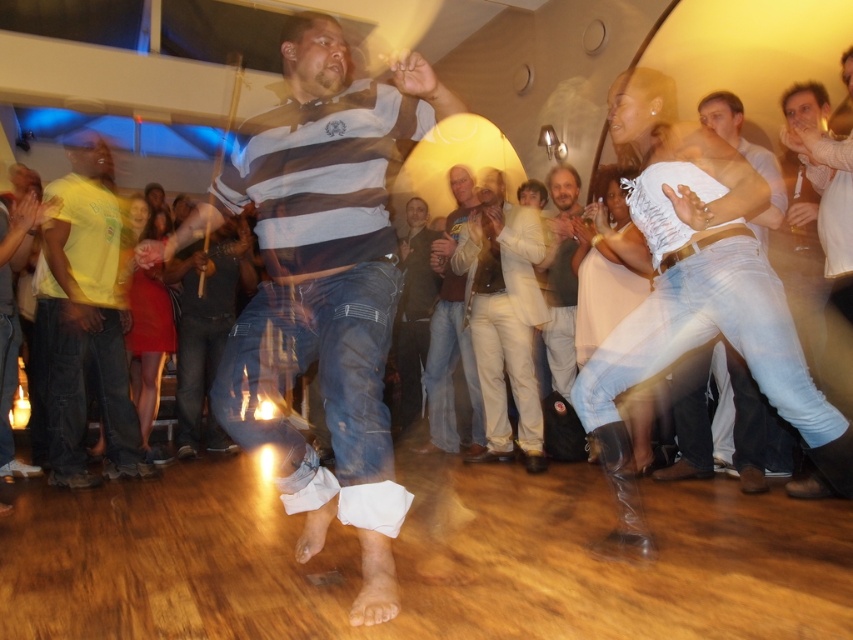
You are at a party and want to take a photo of the light blue jeans at center and dark brown leather jacket at center. To ensure both are in the frame, which object should you place closer to the camera?

The light blue jeans at center is positioned on the right side of dark brown leather jacket at center. To ensure both are in the frame, you should place the dark brown leather jacket at center closer to the camera so that the light blue jeans at center on its right can also be captured within the frame.

You are a photographer at the party and want to capture a photo that includes both the light blue jeans at center and the light blue jeans at right. Since you want to highlight the one that is higher in the frame, which pair of light blue jeans should you focus on?

The light blue jeans at center is above the light blue jeans at right, so you should focus on the light blue jeans at center to highlight the one higher in the frame.